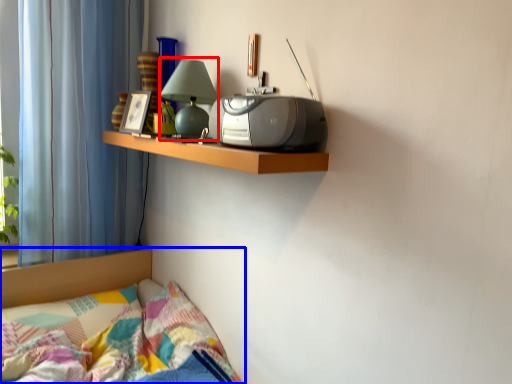
Question: Among these objects, which one is nearest to the camera, table lamp (highlighted by a red box) or bed (highlighted by a blue box)?

Choices:
 (A) table lamp
 (B) bed

Answer: (B)